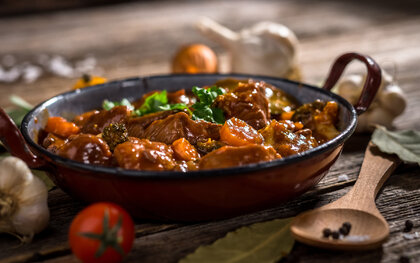
Image resolution: width=420 pixels, height=263 pixels. Identify the location of wooden spoon. (368, 180).